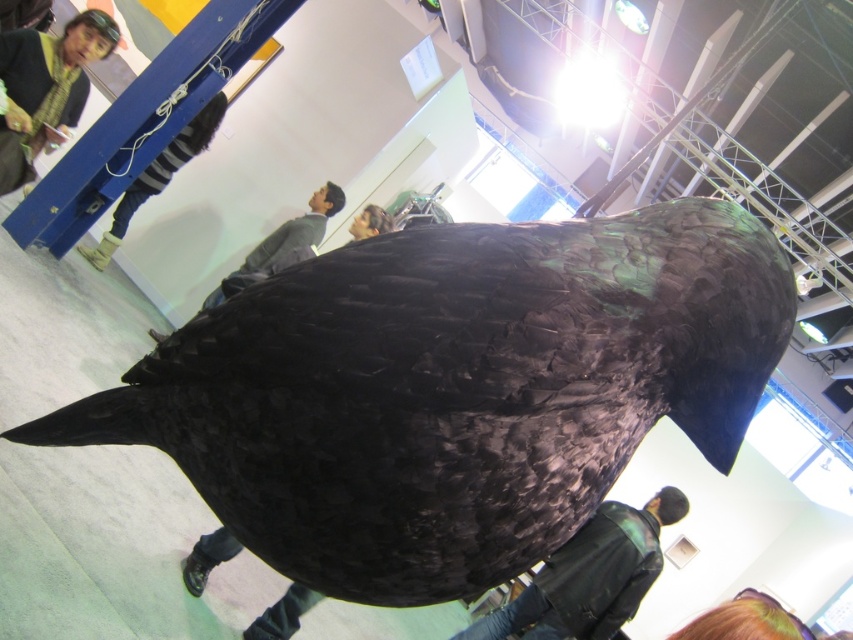
Question: Which point is farther to the camera?

Choices:
 (A) matte black bird at upper center
 (B) shiny black bird at center

Answer: (A)

Question: Does yellow rubber boot at upper left appear on the right side of matte black bird at upper center?

Choices:
 (A) no
 (B) yes

Answer: (A)

Question: Which object is the farthest from the green matte jacket at lower center?

Choices:
 (A) shiny black bird at center
 (B) matte black bird at upper center

Answer: (A)

Question: Which object is positioned farthest from the yellow rubber boot at upper left?

Choices:
 (A) matte black bird at upper center
 (B) dark gray fabric pants at center
 (C) green matte jacket at lower center
 (D) green textured sweater at upper left

Answer: (C)

Question: From the image, what is the correct spatial relationship of green matte jacket at lower center in relation to yellow rubber boot at upper left?

Choices:
 (A) below
 (B) above

Answer: (A)

Question: Does shiny black bird at center appear over yellow rubber boot at upper left?

Choices:
 (A) no
 (B) yes

Answer: (A)